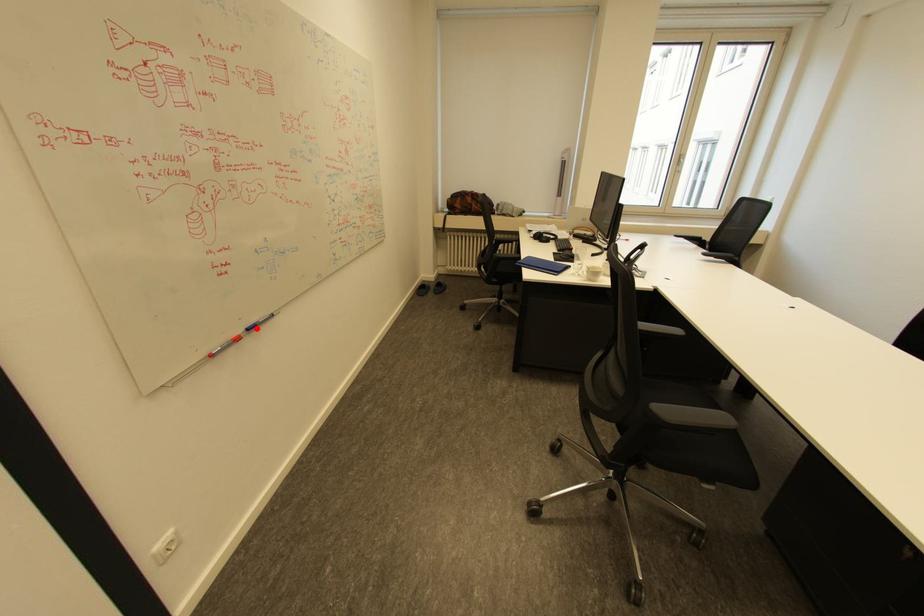
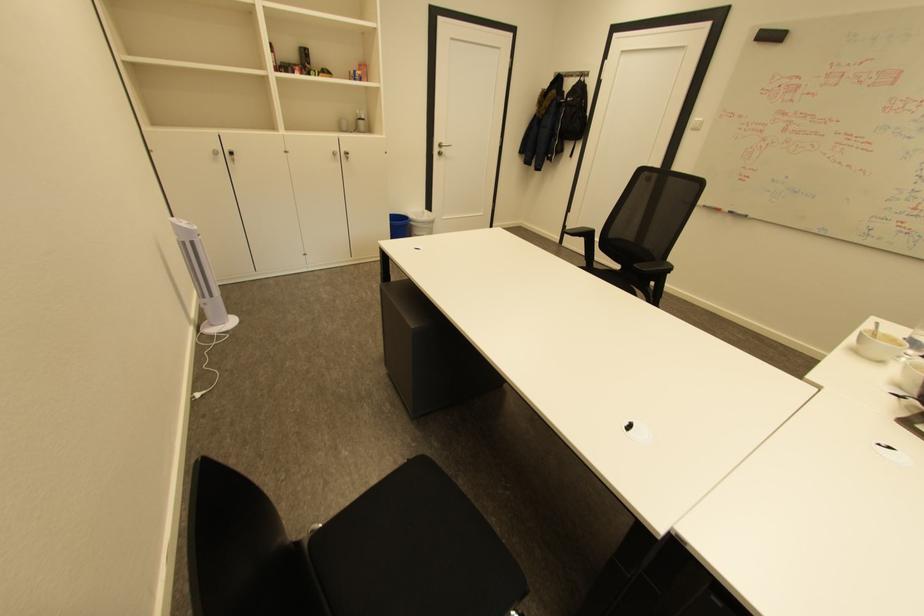
The point at the highlighted location is marked in the first image. Where is the corresponding point in the second image?

(737, 212)